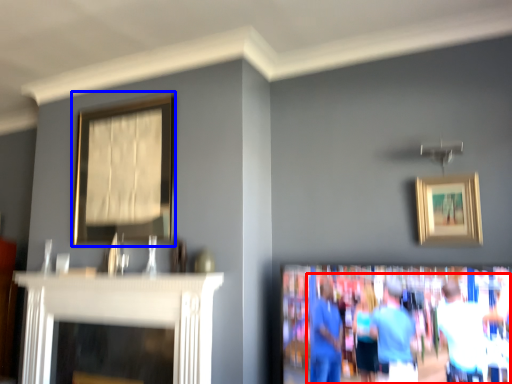
Question: Which object is further to the camera taking this photo, couple (highlighted by a red box) or picture frame (highlighted by a blue box)?

Choices:
 (A) couple
 (B) picture frame

Answer: (B)